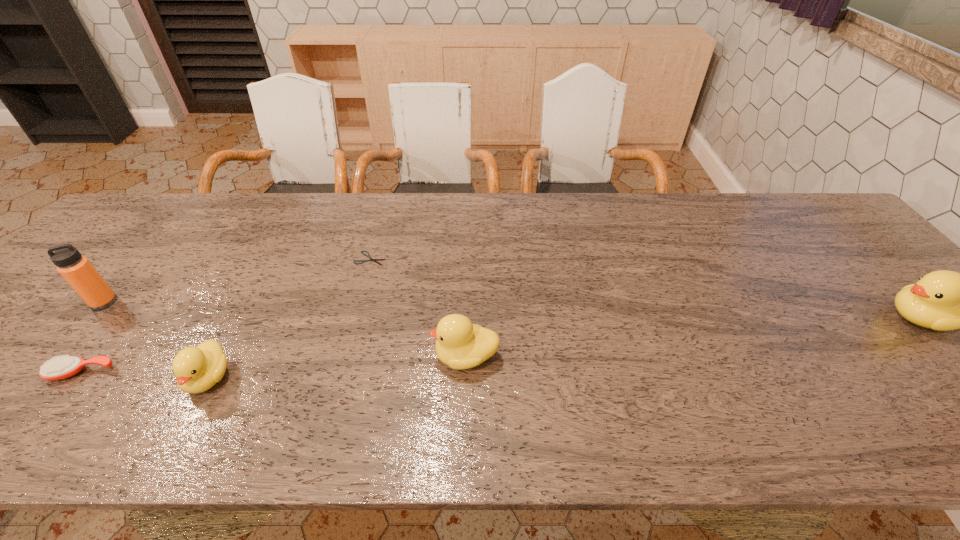
The width and height of the screenshot is (960, 540). Identify the location of the shortest duckling. (197, 369).

Image resolution: width=960 pixels, height=540 pixels. Find the location of `the leftmost duckling`. the leftmost duckling is located at coordinates (197, 369).

Locate an element on the screen. Image resolution: width=960 pixels, height=540 pixels. the second duckling from right to left is located at coordinates (460, 344).

Find the location of a particular element. This screenshot has width=960, height=540. the second shortest duckling is located at coordinates (460, 344).

This screenshot has height=540, width=960. In order to click on the farthest object in this screenshot , I will do `click(368, 255)`.

Image resolution: width=960 pixels, height=540 pixels. I want to click on shears, so click(x=368, y=255).

Where is `the tallest object`? This screenshot has width=960, height=540. the tallest object is located at coordinates (80, 274).

Where is `the second shortest object`? Image resolution: width=960 pixels, height=540 pixels. the second shortest object is located at coordinates (57, 368).

Find the location of `blank space located 0.050m on the beak of the fifth object from left to right`. blank space located 0.050m on the beak of the fifth object from left to right is located at coordinates (410, 356).

The image size is (960, 540). In order to click on vacant area situated on the beak of the fifth object from left to right in this screenshot , I will do `click(259, 356)`.